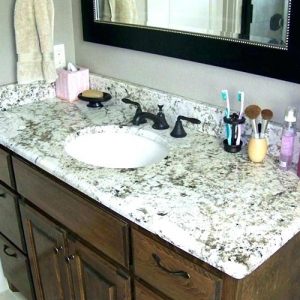
Identify the location of sink. The width and height of the screenshot is (300, 300). (x=120, y=151).